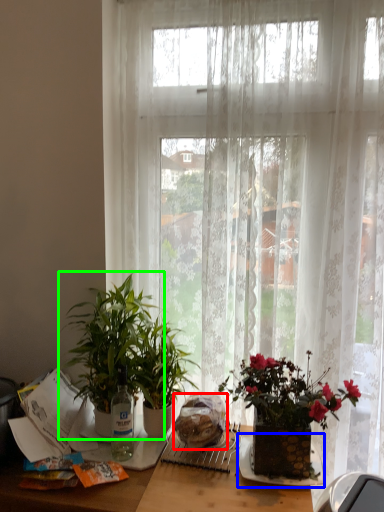
Question: Which object is positioned farthest from food (highlighted by a red box)? Select from plate (highlighted by a blue box) and houseplant (highlighted by a green box).

Choices:
 (A) plate
 (B) houseplant

Answer: (B)